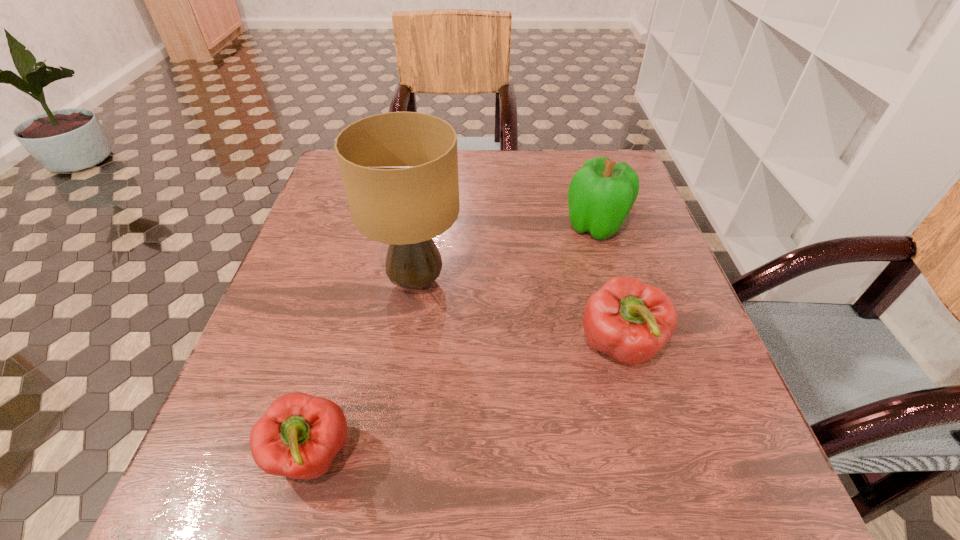
The height and width of the screenshot is (540, 960). I want to click on bell pepper that is the second nearest to the farthest object, so click(299, 435).

At what (x,y) coordinates should I click in order to perform the action: click on vacant space that satisfies the following two spatial constraints: 1. on the back side of the nearest object; 2. on the left side of the lampshade. Please return your answer as a coordinate pair (x, y). This screenshot has height=540, width=960. Looking at the image, I should click on (360, 281).

At what (x,y) coordinates should I click in order to perform the action: click on free location that satisfies the following two spatial constraints: 1. on the back side of the second shortest bell pepper; 2. on the right side of the nearest object. Please return your answer as a coordinate pair (x, y). This screenshot has height=540, width=960. Looking at the image, I should click on (342, 348).

At what (x,y) coordinates should I click in order to perform the action: click on vacant point that satisfies the following two spatial constraints: 1. on the back side of the tallest object; 2. on the right side of the farthest object. Please return your answer as a coordinate pair (x, y). The width and height of the screenshot is (960, 540). Looking at the image, I should click on (424, 226).